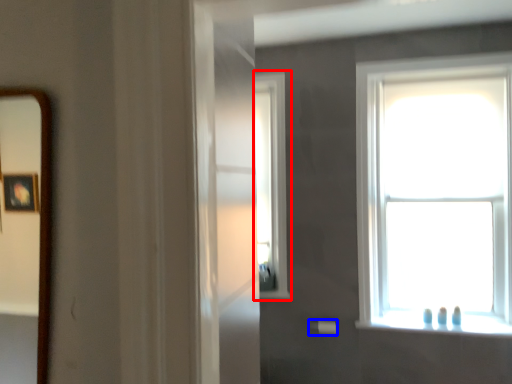
Question: Which object is closer to the camera taking this photo, window (highlighted by a red box) or towel bar (highlighted by a blue box)?

Choices:
 (A) window
 (B) towel bar

Answer: (B)